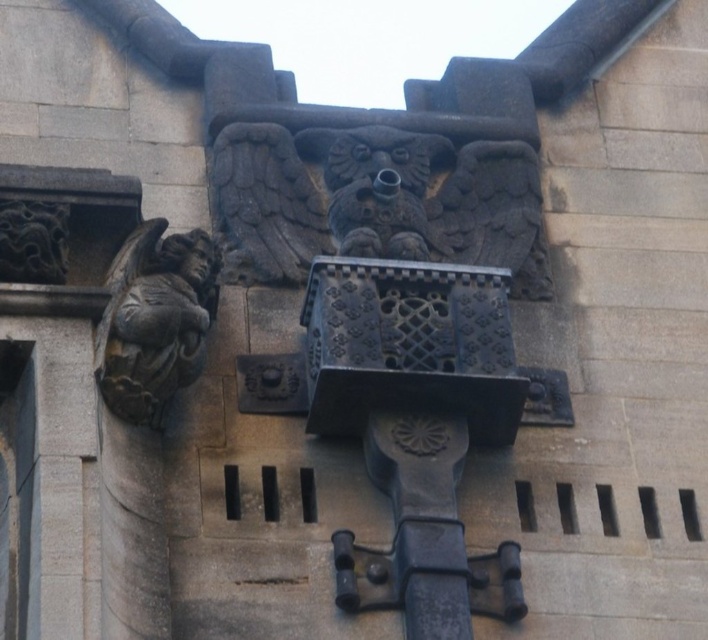
Question: Which point appears closest to the camera in this image?

Choices:
 (A) (142, 317)
 (B) (22, 237)

Answer: (A)

Question: Which point is closer to the camera?

Choices:
 (A) (161, 230)
 (B) (33, 214)

Answer: (B)

Question: Does dark gray stone gargoyle at left lie behind black stone dragon at upper left?

Choices:
 (A) yes
 (B) no

Answer: (A)

Question: Does dark gray stone gargoyle at left appear on the left side of black stone dragon at upper left?

Choices:
 (A) no
 (B) yes

Answer: (A)

Question: Can you confirm if dark gray stone gargoyle at left is positioned to the right of black stone dragon at upper left?

Choices:
 (A) no
 (B) yes

Answer: (B)